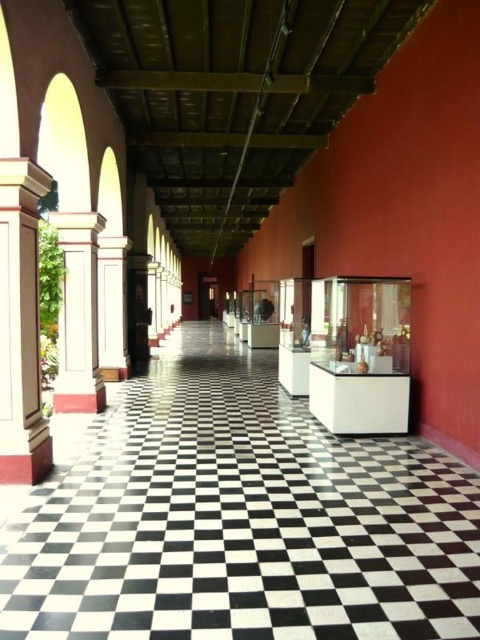
You are standing at the entrance of the corridor and notice two columns on the left side. Which column is positioned closer to the right side of the corridor, the smooth white column at left or the white painted wood column at left?

The smooth white column at left is positioned to the right of the white painted wood column at left, so the smooth white column at left is closer to the right side of the corridor.

You are an architect analyzing the corridor. Which column on the left side is shorter between the smooth white column at left and the white painted wood column at left?

The smooth white column at left is shorter than the white painted wood column at left according to the description.